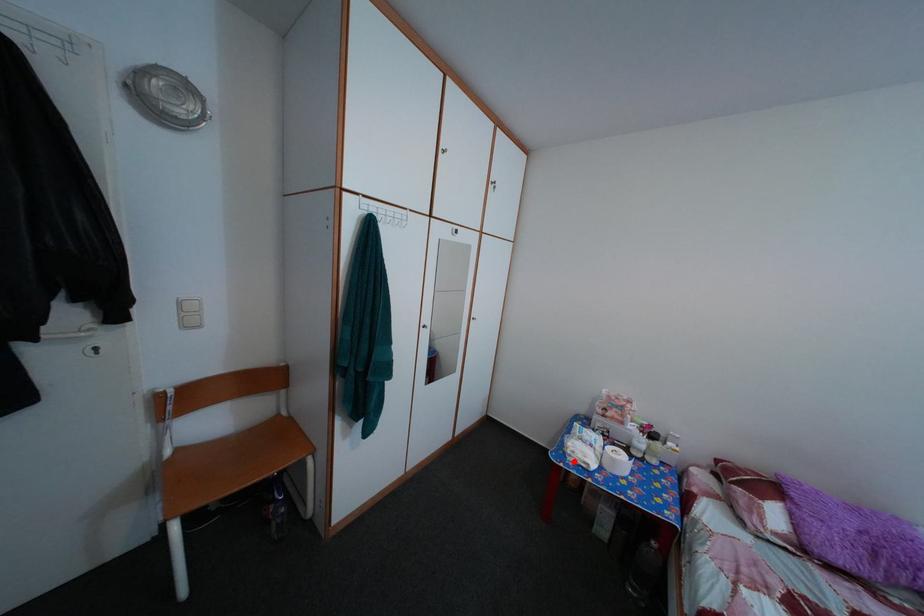
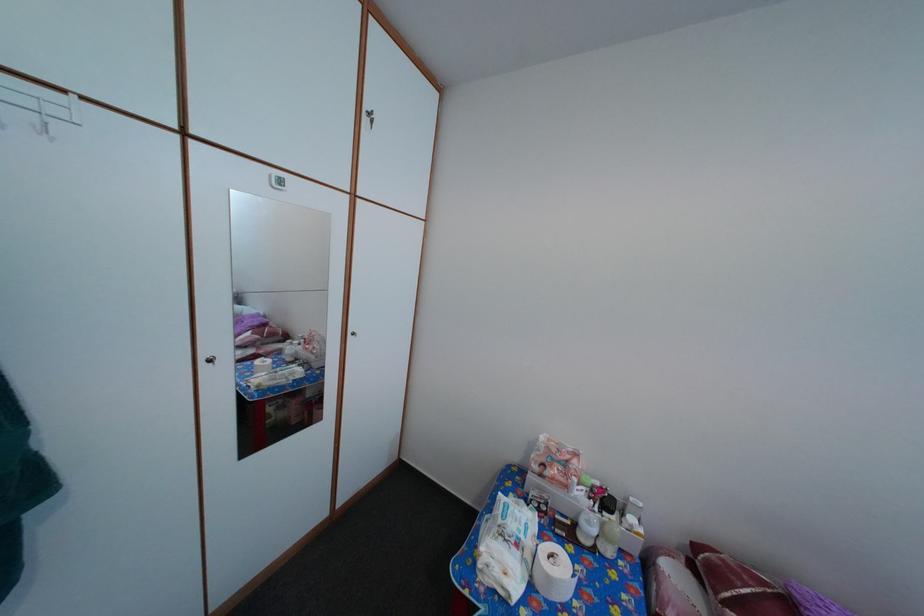
Question: I am providing you with two images of the same scene from different viewpoints. Given a red point in image1, look at the same physical point in image2. Is it:

Choices:
 (A) Closer to the viewpoint
 (B) Farther from the viewpoint

Answer: (B)